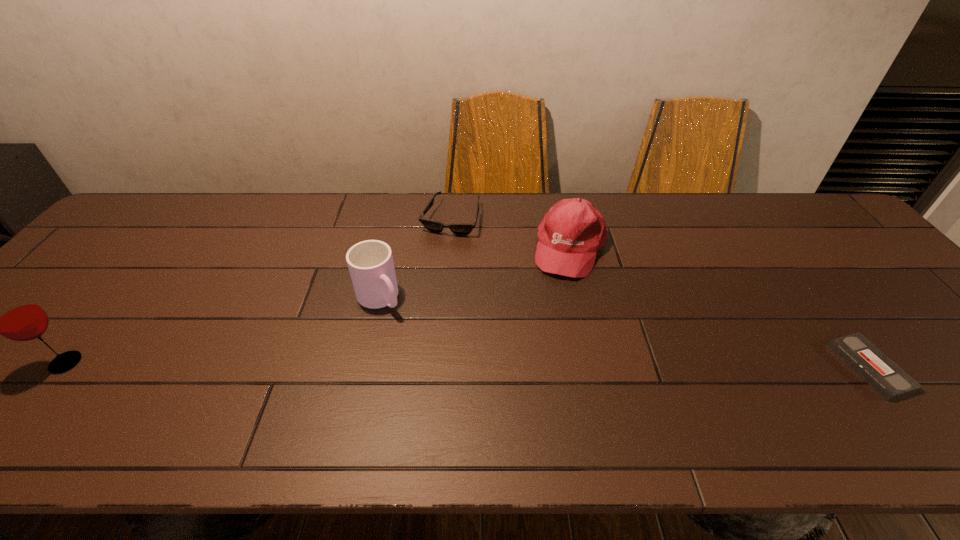
The image size is (960, 540). Find the location of `free space on the desktop that is between the tallest object and the videotape and is positioned with the handle on the side of the second object from left to right`. free space on the desktop that is between the tallest object and the videotape and is positioned with the handle on the side of the second object from left to right is located at coordinates (436, 364).

What are the coordinates of `vacant space on the desktop that is between the glass and the rightmost object and is positioned at the front of the baseball cap with the brim` in the screenshot? It's located at [536, 365].

Locate an element on the screen. vacant space on the desktop that is between the tallest object and the videotape and is positioned on the front-facing side of the sunglasses is located at coordinates (393, 364).